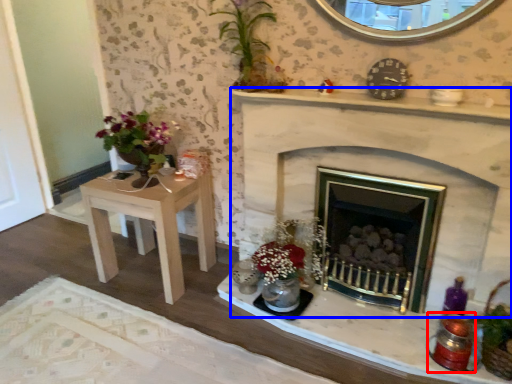
Question: Which of the following is the closest to the observer, candle holder (highlighted by a red box) or fireplace (highlighted by a blue box)?

Choices:
 (A) candle holder
 (B) fireplace

Answer: (B)